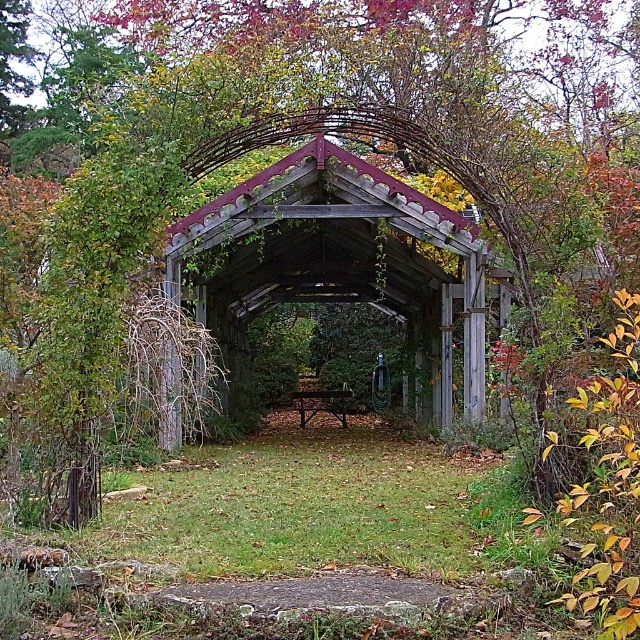
Does wooden gazebo at center lie in front of wooden park bench at center?

Yes, wooden gazebo at center is closer to the viewer.

Can you confirm if wooden gazebo at center is positioned to the right of wooden park bench at center?

Correct, you'll find wooden gazebo at center to the right of wooden park bench at center.

Does point (435, 340) lie behind point (301, 396)?

No, it is not.

Identify the location of wooden gazebo at center. The image size is (640, 640). (342, 260).